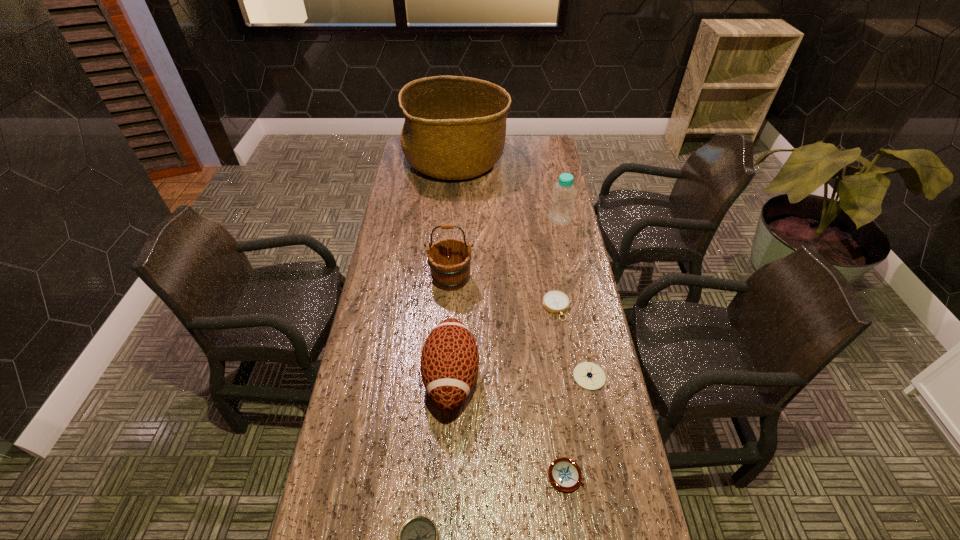
Where is `basket`? Image resolution: width=960 pixels, height=540 pixels. basket is located at coordinates (455, 127).

What are the coordinates of `the farthest object` in the screenshot? It's located at (455, 127).

The height and width of the screenshot is (540, 960). Find the location of `the second tallest object`. the second tallest object is located at coordinates click(449, 260).

Identify the location of wine bucket. (449, 260).

Image resolution: width=960 pixels, height=540 pixels. What are the coordinates of `the second farthest object` in the screenshot? It's located at (562, 204).

I want to click on bottle, so click(562, 204).

Find the location of `the fourth tallest object`. the fourth tallest object is located at coordinates (449, 364).

This screenshot has height=540, width=960. What are the coordinates of `the tallest compass` in the screenshot? It's located at (588, 375).

Where is `the third nearest compass`? The width and height of the screenshot is (960, 540). the third nearest compass is located at coordinates (588, 375).

Image resolution: width=960 pixels, height=540 pixels. What are the coordinates of `the farthest compass` in the screenshot? It's located at (x=556, y=302).